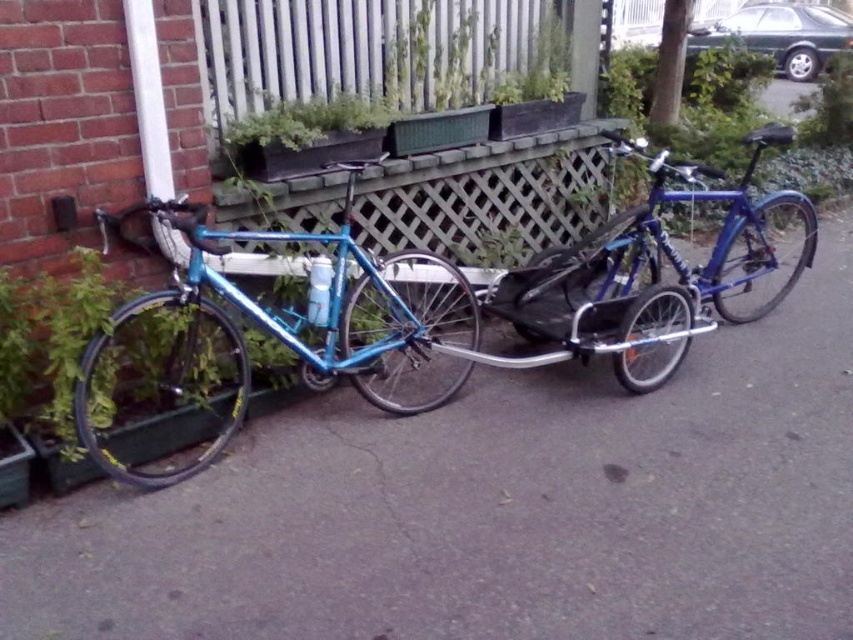
Question: Where is green matte planter at upper center located in relation to green leafy plant at center in the image?

Choices:
 (A) right
 (B) left

Answer: (B)

Question: Which point appears farthest from the camera in this image?

Choices:
 (A) (200, 540)
 (B) (308, 122)

Answer: (B)

Question: Which is nearer to the green leafy plant at center?

Choices:
 (A) green leafy plant at left
 (B) matte blue bicycle at center
 (C) green matte planter at upper center
 (D) blue metallic bicycle at center

Answer: (D)

Question: Considering the relative positions of matte blue bicycle at center and blue metallic bicycle at center in the image provided, where is matte blue bicycle at center located with respect to blue metallic bicycle at center?

Choices:
 (A) left
 (B) right

Answer: (A)

Question: Can you confirm if matte blue bicycle at center is thinner than green matte planter at upper center?

Choices:
 (A) yes
 (B) no

Answer: (B)

Question: Which is nearer to the wooden lattice fence at upper center?

Choices:
 (A) matte blue bicycle at center
 (B) green matte planter at upper center
 (C) matte blue bicycle at left
 (D) green leafy plant at center

Answer: (B)